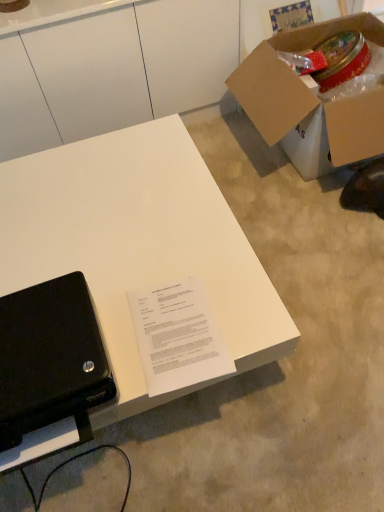
Identify the location of vacant region to the right of white paper at center. (246, 310).